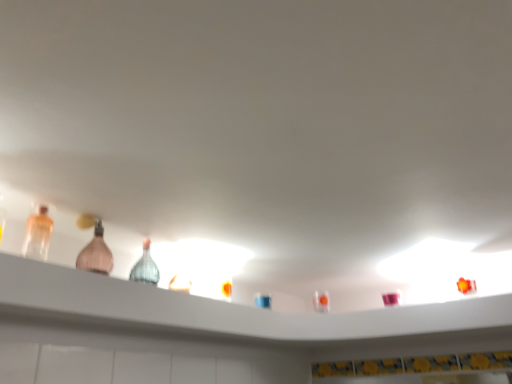
Question: Is translucent glass bottles at upper center wider than pink glass bottle at left, the 2th bottle when ordered from left to right?

Choices:
 (A) yes
 (B) no

Answer: (A)

Question: Is translucent glass bottles at upper center to the left of pink glass bottle at left, which ranks as the first bottle in right-to-left order, from the viewer's perspective?

Choices:
 (A) yes
 (B) no

Answer: (B)

Question: Does translucent glass bottles at upper center appear on the right side of pink glass bottle at left, acting as the first bottle starting from the back?

Choices:
 (A) no
 (B) yes

Answer: (B)

Question: Is there a large distance between translucent glass bottles at upper center and pink glass bottle at left, the 2th bottle when ordered from left to right?

Choices:
 (A) yes
 (B) no

Answer: (B)

Question: From the image's perspective, is translucent glass bottles at upper center under pink glass bottle at left, the 2th bottle when ordered from left to right?

Choices:
 (A) yes
 (B) no

Answer: (A)

Question: Considering the relative positions of translucent glass bottles at upper center and pink glass bottle at left, the 2th bottle when ordered from left to right, in the image provided, is translucent glass bottles at upper center behind pink glass bottle at left, the 2th bottle when ordered from left to right,?

Choices:
 (A) yes
 (B) no

Answer: (B)

Question: Are pink glass bottle at left, which ranks as the first bottle in right-to-left order, and translucent plastic bottle at left, which is counted as the second bottle, starting from the back, located far from each other?

Choices:
 (A) yes
 (B) no

Answer: (B)

Question: Considering the relative sizes of pink glass bottle at left, acting as the first bottle starting from the back, and translucent plastic bottle at left, the first bottle in the front-to-back sequence, in the image provided, is pink glass bottle at left, acting as the first bottle starting from the back, smaller than translucent plastic bottle at left, the first bottle in the front-to-back sequence,?

Choices:
 (A) no
 (B) yes

Answer: (A)

Question: Can you confirm if pink glass bottle at left, acting as the first bottle starting from the back, is wider than translucent plastic bottle at left, which is counted as the second bottle, starting from the back?

Choices:
 (A) no
 (B) yes

Answer: (B)

Question: Is pink glass bottle at left, which is the second bottle from front to back, outside of translucent plastic bottle at left, which is counted as the second bottle, starting from the back?

Choices:
 (A) no
 (B) yes

Answer: (B)

Question: Does pink glass bottle at left, acting as the first bottle starting from the back, have a greater height compared to translucent plastic bottle at left, the first bottle in the front-to-back sequence?

Choices:
 (A) yes
 (B) no

Answer: (A)

Question: Could you tell me if pink glass bottle at left, the 2th bottle when ordered from left to right, is turned towards translucent plastic bottle at left, the 2th bottle in the right-to-left sequence?

Choices:
 (A) no
 (B) yes

Answer: (A)

Question: Is translucent plastic bottle at left, the first bottle in the front-to-back sequence, completely or partially outside of pink glass bottle at left, which is the second bottle from front to back?

Choices:
 (A) yes
 (B) no

Answer: (A)